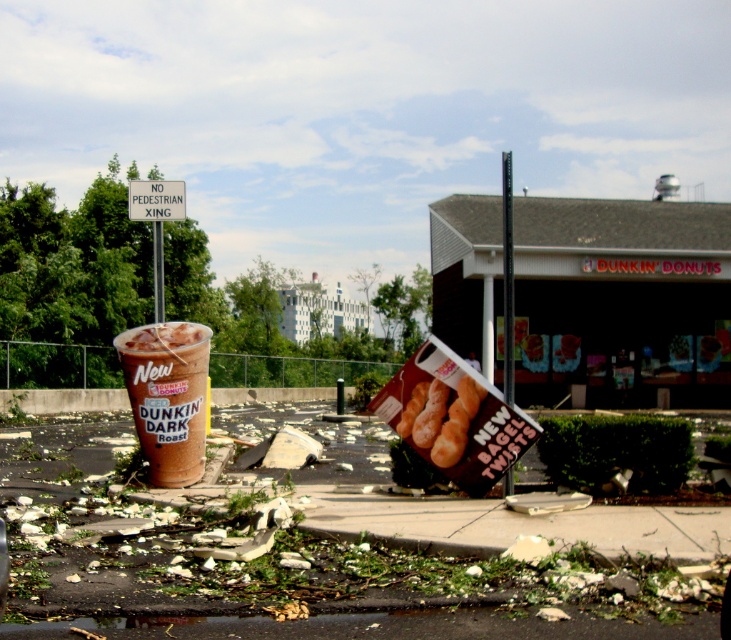
What do you see at coordinates (439, 419) in the screenshot? The width and height of the screenshot is (731, 640). I see `golden brown donut at center` at bounding box center [439, 419].

Who is positioned more to the right, golden brown donut at center or white plastic sign at upper center?

golden brown donut at center

Between point (458, 428) and point (174, 189), which one is positioned behind?

The point (174, 189) is more distant.

You are a GUI agent. You are given a task and a screenshot of the screen. Output one action in this format:
    pyautogui.click(x=<x>, y=<y>)
    Task: Click on the golden brown donut at center
    This screenshot has width=731, height=640.
    Given the screenshot: What is the action you would take?
    pyautogui.click(x=439, y=419)

Is smooth concrete pavement at lower center smaller than matte plastic cup at center-left?

Incorrect, smooth concrete pavement at lower center is not smaller in size than matte plastic cup at center-left.

Where is `smooth concrete pavement at lower center`? Image resolution: width=731 pixels, height=640 pixels. smooth concrete pavement at lower center is located at coordinates [x=314, y=580].

Is smooth concrete pavement at lower center thinner than golden brown donut at center?

In fact, smooth concrete pavement at lower center might be wider than golden brown donut at center.

Is point (450, 588) closer to viewer compared to point (481, 397)?

That is True.

Find the location of a particular element. The image size is (731, 640). smooth concrete pavement at lower center is located at coordinates 314,580.